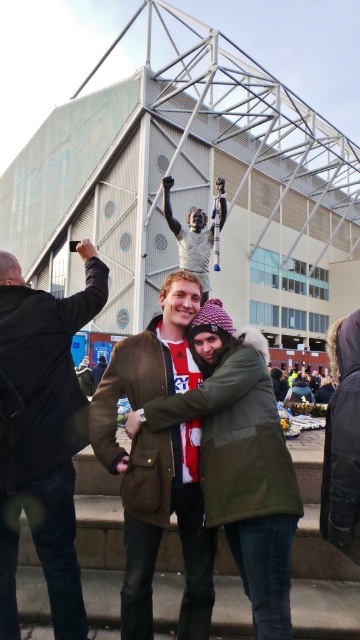
Does dark brown leather jacket at upper left have a lesser height compared to brown suede jacket at center?

Incorrect, dark brown leather jacket at upper left's height does not fall short of brown suede jacket at center's.

Is point (6, 476) less distant than point (123, 477)?

Yes, point (6, 476) is in front of point (123, 477).

Identify the location of dark brown leather jacket at upper left. Image resolution: width=360 pixels, height=640 pixels. (43, 436).